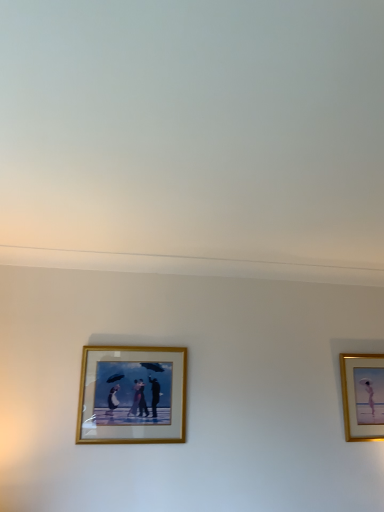
In order to click on gold/glass picture frame at center, acting as the 1th picture frame starting from the left in this screenshot , I will do `click(132, 395)`.

Image resolution: width=384 pixels, height=512 pixels. What do you see at coordinates (132, 395) in the screenshot?
I see `gold/glass picture frame at center, which appears as the first picture frame when viewed from the front` at bounding box center [132, 395].

Identify the location of gold-framed picture at right, the 1th picture frame in the back-to-front sequence. (362, 395).

What do you see at coordinates (362, 395) in the screenshot?
I see `gold-framed picture at right, which ranks as the first picture frame in right-to-left order` at bounding box center [362, 395].

In order to face gold-framed picture at right, the second picture frame in the left-to-right sequence, should I rotate leftwards or rightwards?

You should look right and rotate roughly 22.523 degrees.

Measure the distance between point (365, 356) and camera.

The distance of point (365, 356) from camera is 2.54 meters.

The image size is (384, 512). I want to click on gold/glass picture frame at center, the second picture frame in the right-to-left sequence, so click(x=132, y=395).

Is gold-framed picture at right, the 1th picture frame in the back-to-front sequence, to the left or to the right of gold/glass picture frame at center, acting as the 1th picture frame starting from the left, in the image?

Clearly, gold-framed picture at right, the 1th picture frame in the back-to-front sequence, is on the right of gold/glass picture frame at center, acting as the 1th picture frame starting from the left, in the image.

Considering the relative positions of gold-framed picture at right, the second picture frame in the left-to-right sequence, and gold/glass picture frame at center, acting as the 1th picture frame starting from the left, in the image provided, is gold-framed picture at right, the second picture frame in the left-to-right sequence, behind gold/glass picture frame at center, acting as the 1th picture frame starting from the left,?

Yes, gold-framed picture at right, the second picture frame in the left-to-right sequence, is further from the viewer.

Between point (348, 402) and point (164, 421), which one is positioned in front?

The point (164, 421) is closer to the camera.

From the image's perspective, is gold-framed picture at right, the second picture frame in the left-to-right sequence, located above gold/glass picture frame at center, the second picture frame in the right-to-left sequence?

Actually, gold-framed picture at right, the second picture frame in the left-to-right sequence, appears below gold/glass picture frame at center, the second picture frame in the right-to-left sequence, in the image.

From a real-world perspective, is gold-framed picture at right, which ranks as the first picture frame in right-to-left order, positioned over gold/glass picture frame at center, acting as the 1th picture frame starting from the left, based on gravity?

Yes, from a real-world perspective, gold-framed picture at right, which ranks as the first picture frame in right-to-left order, is above gold/glass picture frame at center, acting as the 1th picture frame starting from the left.

Is gold-framed picture at right, the second picture frame in the left-to-right sequence, wider than gold/glass picture frame at center, the second picture frame in the right-to-left sequence?

Incorrect, the width of gold-framed picture at right, the second picture frame in the left-to-right sequence, does not surpass that of gold/glass picture frame at center, the second picture frame in the right-to-left sequence.

Is gold-framed picture at right, the second picture frame in the left-to-right sequence, taller or shorter than gold/glass picture frame at center, which is the second picture frame in back-to-front order?

In the image, gold-framed picture at right, the second picture frame in the left-to-right sequence, appears to be taller than gold/glass picture frame at center, which is the second picture frame in back-to-front order.

Between gold-framed picture at right, the 1th picture frame in the back-to-front sequence, and gold/glass picture frame at center, the second picture frame in the right-to-left sequence, which one has smaller size?

gold-framed picture at right, the 1th picture frame in the back-to-front sequence, is smaller.

Is gold-framed picture at right, acting as the 2th picture frame starting from the front, spatially inside gold/glass picture frame at center, acting as the 1th picture frame starting from the left, or outside of it?

gold-framed picture at right, acting as the 2th picture frame starting from the front, is spatially situated outside gold/glass picture frame at center, acting as the 1th picture frame starting from the left.

Is gold-framed picture at right, the 1th picture frame in the back-to-front sequence, touching gold/glass picture frame at center, the second picture frame in the right-to-left sequence?

gold-framed picture at right, the 1th picture frame in the back-to-front sequence, is not next to gold/glass picture frame at center, the second picture frame in the right-to-left sequence, and they're not touching.

Is gold-framed picture at right, acting as the 2th picture frame starting from the front, facing away from gold/glass picture frame at center, the second picture frame in the right-to-left sequence?

No, gold/glass picture frame at center, the second picture frame in the right-to-left sequence, is not at the back of gold-framed picture at right, acting as the 2th picture frame starting from the front.

How distant is gold-framed picture at right, acting as the 2th picture frame starting from the front, from gold/glass picture frame at center, which appears as the first picture frame when viewed from the front?

gold-framed picture at right, acting as the 2th picture frame starting from the front, and gold/glass picture frame at center, which appears as the first picture frame when viewed from the front, are 3.77 feet apart from each other.

Locate an element on the screen. picture frame located on the right of gold/glass picture frame at center, which appears as the first picture frame when viewed from the front is located at coordinates (362, 395).

Considering the relative positions of gold/glass picture frame at center, which is the second picture frame in back-to-front order, and gold-framed picture at right, the second picture frame in the left-to-right sequence, in the image provided, is gold/glass picture frame at center, which is the second picture frame in back-to-front order, to the right of gold-framed picture at right, the second picture frame in the left-to-right sequence, from the viewer's perspective?

No, gold/glass picture frame at center, which is the second picture frame in back-to-front order, is not to the right of gold-framed picture at right, the second picture frame in the left-to-right sequence.

Which object is more forward, gold/glass picture frame at center, acting as the 1th picture frame starting from the left, or gold-framed picture at right, the 1th picture frame in the back-to-front sequence?

gold/glass picture frame at center, acting as the 1th picture frame starting from the left, is in front.

Which is further, (109,404) or (345,401)?

The point (345,401) is farther from the camera.

From the image's perspective, which object appears higher, gold/glass picture frame at center, acting as the 1th picture frame starting from the left, or gold-framed picture at right, acting as the 2th picture frame starting from the front?

From the image's view, gold/glass picture frame at center, acting as the 1th picture frame starting from the left, is above.

From a real-world perspective, which object rests below the other?

gold/glass picture frame at center, which is the second picture frame in back-to-front order, from a real-world perspective.

Considering the relative sizes of gold/glass picture frame at center, which is the second picture frame in back-to-front order, and gold-framed picture at right, the 1th picture frame in the back-to-front sequence, in the image provided, is gold/glass picture frame at center, which is the second picture frame in back-to-front order, thinner than gold-framed picture at right, the 1th picture frame in the back-to-front sequence,?

No, gold/glass picture frame at center, which is the second picture frame in back-to-front order, is not thinner than gold-framed picture at right, the 1th picture frame in the back-to-front sequence.

Is gold/glass picture frame at center, which is the second picture frame in back-to-front order, taller or shorter than gold-framed picture at right, acting as the 2th picture frame starting from the front?

Clearly, gold/glass picture frame at center, which is the second picture frame in back-to-front order, is shorter compared to gold-framed picture at right, acting as the 2th picture frame starting from the front.

Can you confirm if gold/glass picture frame at center, the second picture frame in the right-to-left sequence, is bigger than gold-framed picture at right, acting as the 2th picture frame starting from the front?

Yes.

Is gold/glass picture frame at center, which appears as the first picture frame when viewed from the front, outside of gold-framed picture at right, the 1th picture frame in the back-to-front sequence?

gold/glass picture frame at center, which appears as the first picture frame when viewed from the front, lies outside gold-framed picture at right, the 1th picture frame in the back-to-front sequence,'s area.

Does gold/glass picture frame at center, the second picture frame in the right-to-left sequence, touch gold-framed picture at right, which ranks as the first picture frame in right-to-left order?

There is a gap between gold/glass picture frame at center, the second picture frame in the right-to-left sequence, and gold-framed picture at right, which ranks as the first picture frame in right-to-left order.

Is gold/glass picture frame at center, the second picture frame in the right-to-left sequence, turned away from gold-framed picture at right, which ranks as the first picture frame in right-to-left order?

gold/glass picture frame at center, the second picture frame in the right-to-left sequence, is not turned away from gold-framed picture at right, which ranks as the first picture frame in right-to-left order.

In the scene shown: How many degrees apart are the facing directions of gold/glass picture frame at center, the second picture frame in the right-to-left sequence, and gold-framed picture at right, the second picture frame in the left-to-right sequence?

The angle between the facing direction of gold/glass picture frame at center, the second picture frame in the right-to-left sequence, and the facing direction of gold-framed picture at right, the second picture frame in the left-to-right sequence, is 0.181 degrees.

Could you measure the distance between gold/glass picture frame at center, which appears as the first picture frame when viewed from the front, and gold-framed picture at right, acting as the 2th picture frame starting from the front?

gold/glass picture frame at center, which appears as the first picture frame when viewed from the front, is 1.15 meters away from gold-framed picture at right, acting as the 2th picture frame starting from the front.

The image size is (384, 512). There is a gold/glass picture frame at center, which appears as the first picture frame when viewed from the front. What are the coordinates of `picture frame above it (from a real-world perspective)` in the screenshot? It's located at (362, 395).

At what (x,y) coordinates should I click in order to perform the action: click on picture frame that is above the gold/glass picture frame at center, the second picture frame in the right-to-left sequence (from a real-world perspective). Please return your answer as a coordinate pair (x, y). Looking at the image, I should click on (362, 395).

Where is `picture frame in front of the gold-framed picture at right, which ranks as the first picture frame in right-to-left order`? Image resolution: width=384 pixels, height=512 pixels. picture frame in front of the gold-framed picture at right, which ranks as the first picture frame in right-to-left order is located at coordinates (132, 395).